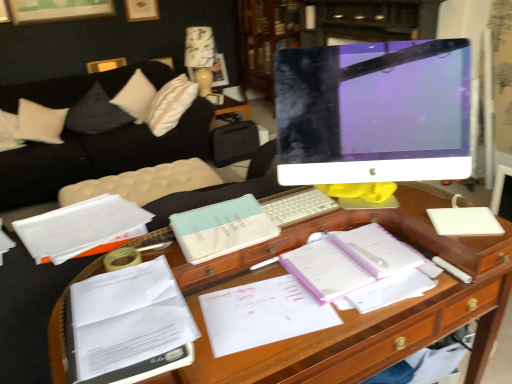
Where is `free location above white paper at center (from a real-world perspective)`? The width and height of the screenshot is (512, 384). free location above white paper at center (from a real-world perspective) is located at coordinates (263, 306).